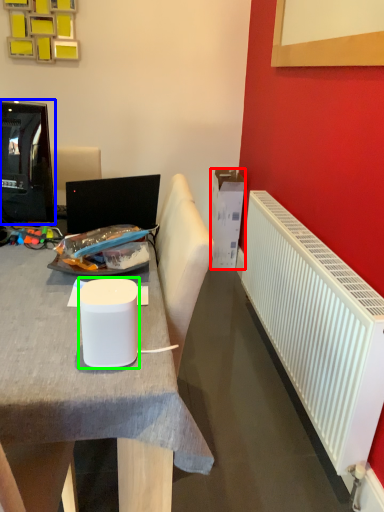
Question: Considering the real-world distances, which object is closest to box (highlighted by a red box)? television (highlighted by a blue box) or paper cup (highlighted by a green box).

Choices:
 (A) television
 (B) paper cup

Answer: (A)